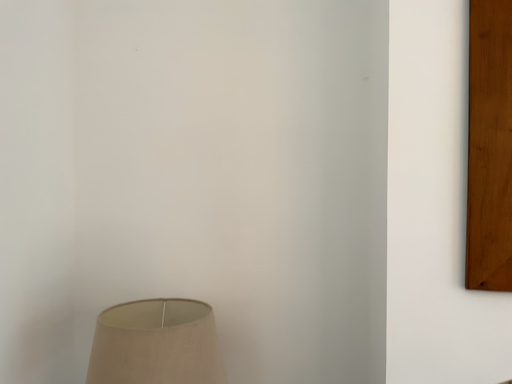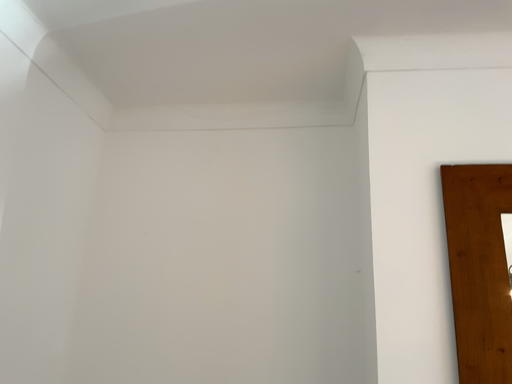
Question: How did the camera likely rotate when shooting the video?

Choices:
 (A) rotated upward
 (B) rotated downward

Answer: (A)